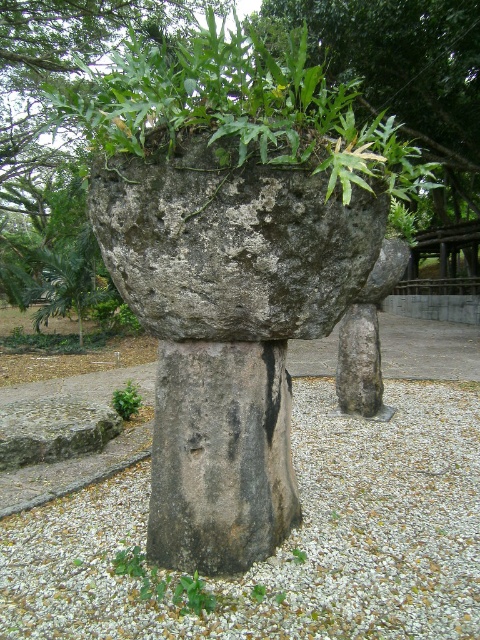
Is the position of gray stone statue at center more distant than that of green leafy plant at center?

No, it is not.

Is gray stone statue at center taller than green leafy plant at center?

Indeed, gray stone statue at center has a greater height compared to green leafy plant at center.

Who is more distant from viewer, (403, 241) or (116, 397)?

The point (403, 241) is more distant.

At what (x,y) coordinates should I click in order to perform the action: click on gray stone statue at center. Please return your answer as a coordinate pair (x, y). The image size is (480, 640). Looking at the image, I should click on (367, 333).

Is gray gravel at center shorter than green rough stone at upper center?

Indeed, gray gravel at center has a lesser height compared to green rough stone at upper center.

Does gray gravel at center appear over green rough stone at upper center?

No.

The image size is (480, 640). What do you see at coordinates (288, 538) in the screenshot?
I see `gray gravel at center` at bounding box center [288, 538].

At what (x,y) coordinates should I click in order to perform the action: click on gray gravel at center. Please return your answer as a coordinate pair (x, y). The width and height of the screenshot is (480, 640). Looking at the image, I should click on (288, 538).

Measure the distance between gray rough stone at center and camera.

gray rough stone at center is 6.91 feet from camera.

Locate an element on the screen. gray rough stone at center is located at coordinates pyautogui.click(x=231, y=243).

Is point (287, 284) in front of point (132, 406)?

That is True.

Find the location of `gray rough stone at center`. gray rough stone at center is located at coordinates (231, 243).